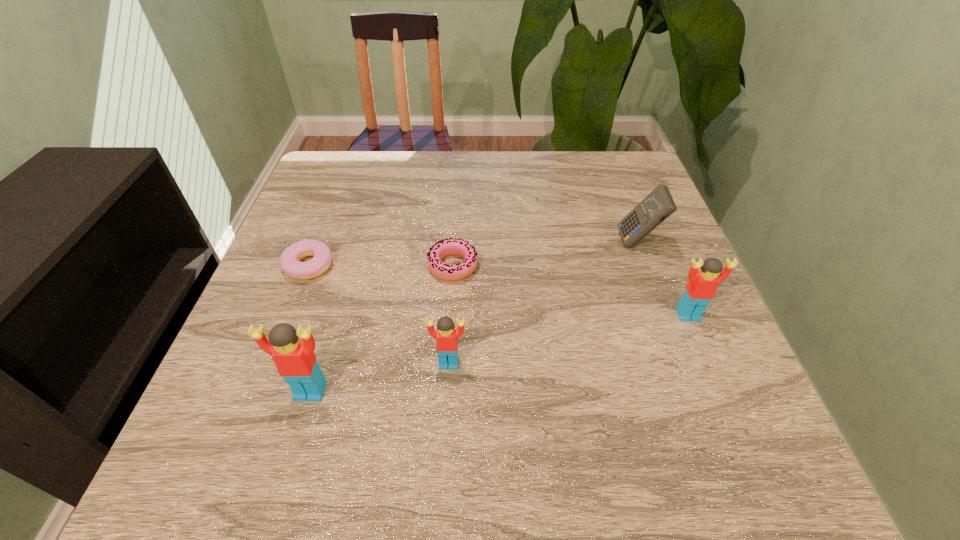
Identify the location of calculator located in the right edge section of the desktop. The width and height of the screenshot is (960, 540). (657, 206).

At what (x,y) coordinates should I click in order to perform the action: click on object situated at the near left corner. Please return your answer as a coordinate pair (x, y). Looking at the image, I should click on (294, 358).

In the image, there is a desktop. In order to click on vacant space at the far edge in this screenshot , I will do `click(509, 154)`.

The width and height of the screenshot is (960, 540). What are the coordinates of `free space at the near edge of the desktop` in the screenshot? It's located at (470, 421).

In order to click on vacant space at the left edge of the desktop in this screenshot , I will do `click(314, 225)`.

In the image, there is a desktop. In order to click on vacant region at the right edge in this screenshot , I will do `click(621, 202)`.

In the image, there is a desktop. Find the location of `free space at the far right corner`. free space at the far right corner is located at coordinates (597, 151).

The image size is (960, 540). Find the location of `vacant region at the near right corner of the desktop`. vacant region at the near right corner of the desktop is located at coordinates (675, 390).

In order to click on vacant region between the farthest Lego and the right doughnut in this screenshot , I will do `click(570, 290)`.

You are a GUI agent. You are given a task and a screenshot of the screen. Output one action in this format:
    pyautogui.click(x=<x>, y=<y>)
    Task: Click on the blank region between the calculator and the nearest object
    This screenshot has height=540, width=960.
    Given the screenshot: What is the action you would take?
    pyautogui.click(x=474, y=316)